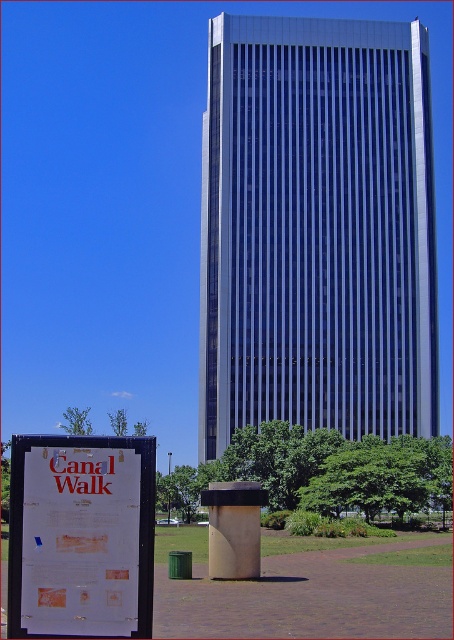
Based on the photo, you are a tourist standing at the Canal Walk signpost. You want to take a photo of the silver glass skyscraper at center and the green leafy tree at lower left together in the frame. Which direction should you face to include both in your photo?

You should face towards the right of the green leafy tree at lower left to include both the silver glass skyscraper at center and the green leafy tree at lower left in your photo, since the silver glass skyscraper at center is located to the right of the green leafy tree at lower left.